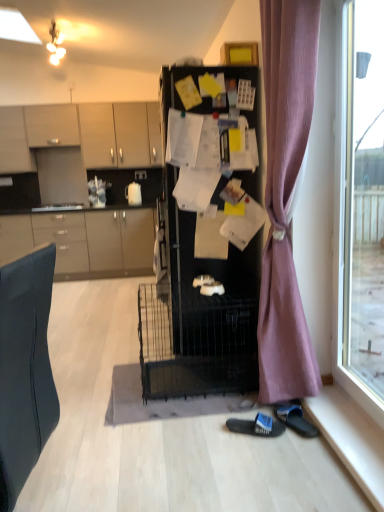
Where is `vacant region above black fabric slipper at lower center, acting as the 1th footwear starting from the left (from a real-world perspective)`? The height and width of the screenshot is (512, 384). vacant region above black fabric slipper at lower center, acting as the 1th footwear starting from the left (from a real-world perspective) is located at coordinates (263, 417).